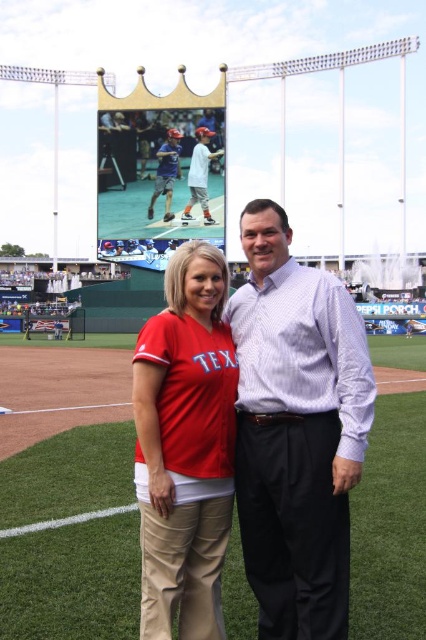
The width and height of the screenshot is (426, 640). What do you see at coordinates (296, 429) in the screenshot? I see `white striped shirt at center` at bounding box center [296, 429].

Is point (351, 376) closer to viewer compared to point (199, 548)?

Yes.

In order to click on white striped shirt at center in this screenshot , I will do `click(296, 429)`.

Which is more to the right, matte red jersey at center or matte blue shirt at center?

matte red jersey at center

Consider the image. Measure the distance between point [184,634] and camera.

42.84 meters

Image resolution: width=426 pixels, height=640 pixels. I want to click on matte red jersey at center, so click(184, 445).

The height and width of the screenshot is (640, 426). What do you see at coordinates (199, 173) in the screenshot? I see `light blue shirt at center` at bounding box center [199, 173].

Does point (207, 177) come closer to viewer compared to point (169, 177)?

Yes, it is.

Does point (192, 166) come behind point (166, 195)?

No, it is not.

This screenshot has width=426, height=640. I want to click on light blue shirt at center, so click(x=199, y=173).